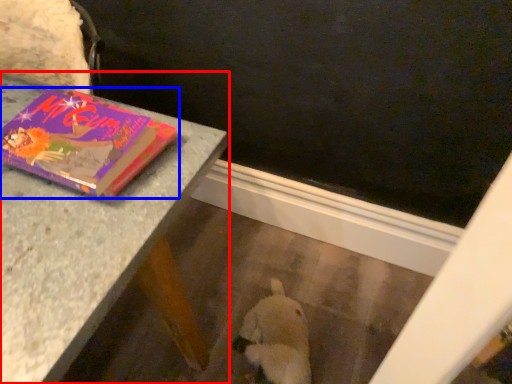
Question: Which of the following is the closest to the observer, table (highlighted by a red box) or book (highlighted by a blue box)?

Choices:
 (A) table
 (B) book

Answer: (B)